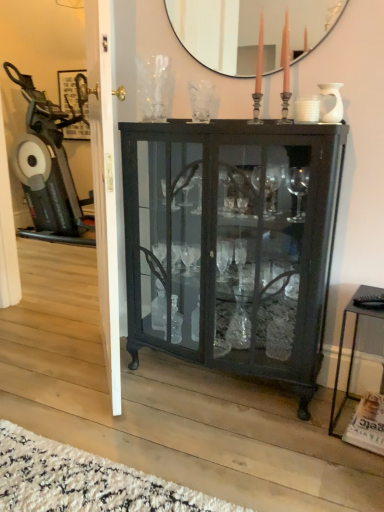
Identify the location of vacant region in front of white glossy door at center. Image resolution: width=384 pixels, height=512 pixels. (102, 419).